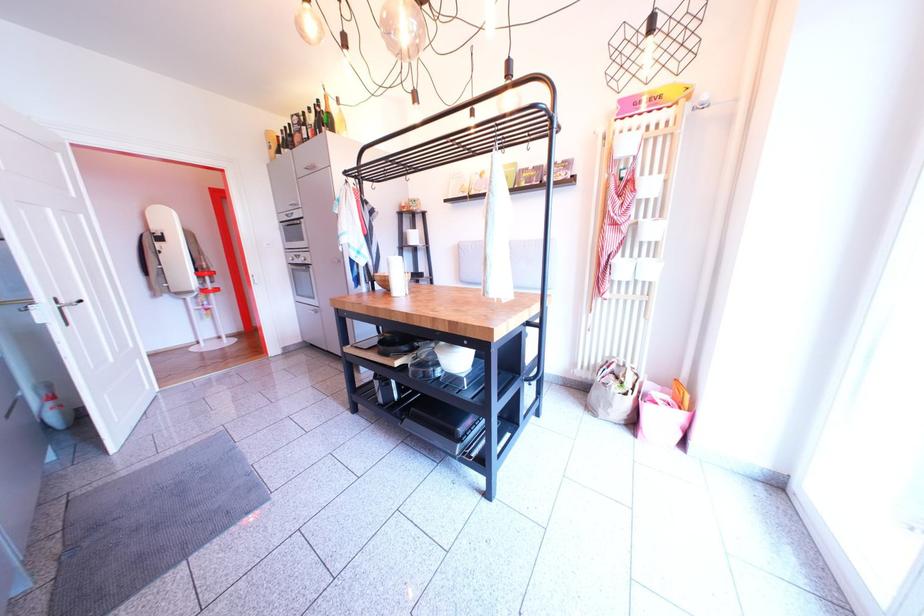
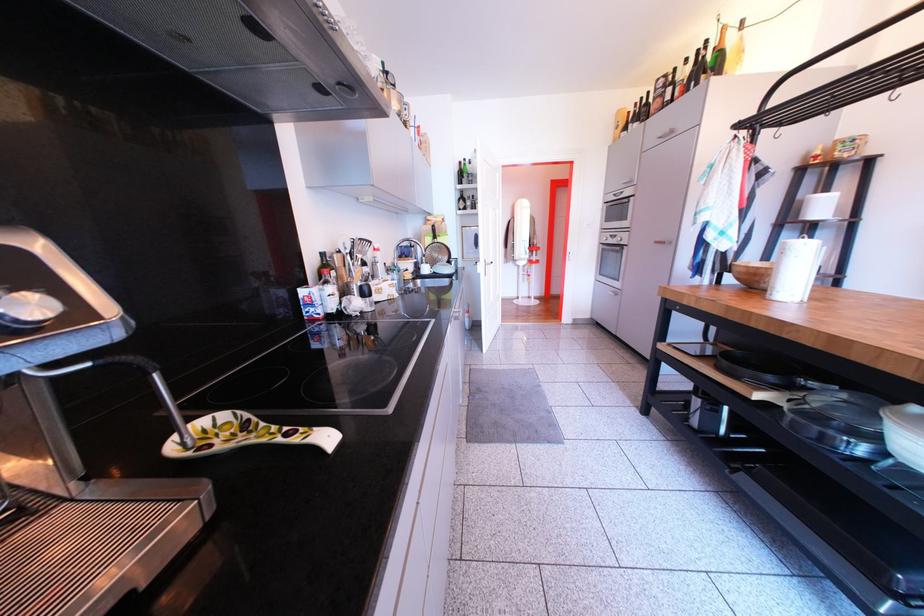
Where in the second image is the point corresponding to point 309,262 from the first image?

(624, 243)